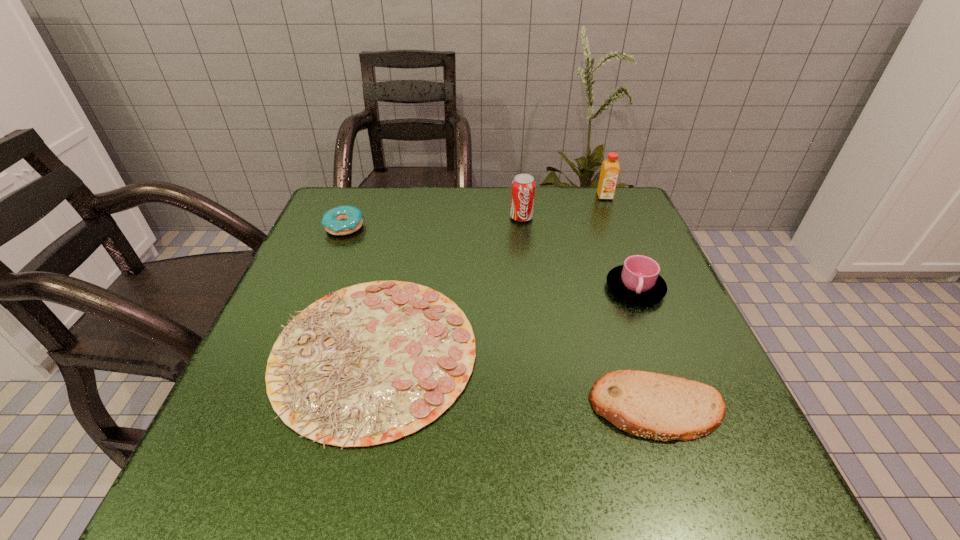
Image resolution: width=960 pixels, height=540 pixels. What are the coordinates of `free spot between the doughnut and the farthest object` in the screenshot? It's located at (474, 212).

Where is `free spot between the orange juice and the pizza`? The height and width of the screenshot is (540, 960). free spot between the orange juice and the pizza is located at coordinates (490, 275).

Where is `free point between the cup and the pizza`? This screenshot has height=540, width=960. free point between the cup and the pizza is located at coordinates pyautogui.click(x=505, y=321).

Identify which object is the third closest to the soda can. Please provide its 2D coordinates. Your answer should be formatted as a tuple, i.e. [(x, y)], where the tuple contains the x and y coordinates of a point satisfying the conditions above.

[(368, 364)]

Identify which object is the third closest to the fourth shortest object. Please provide its 2D coordinates. Your answer should be formatted as a tuple, i.e. [(x, y)], where the tuple contains the x and y coordinates of a point satisfying the conditions above.

[(368, 364)]

What are the coordinates of `vacant region that satisfies the following two spatial constraints: 1. on the front side of the doughnut; 2. on the right side of the pizza` in the screenshot? It's located at (292, 354).

Locate an element on the screen. The height and width of the screenshot is (540, 960). free spot that satisfies the following two spatial constraints: 1. on the logo side of the fourth object from right to left; 2. on the right side of the pita bread is located at coordinates (545, 408).